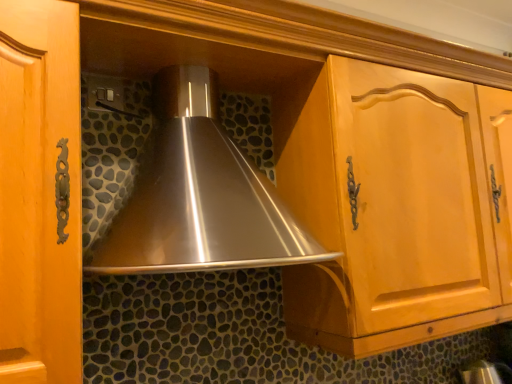
What do you see at coordinates (199, 195) in the screenshot? I see `stainless steel vent at center` at bounding box center [199, 195].

Where is `stainless steel vent at center`? The height and width of the screenshot is (384, 512). stainless steel vent at center is located at coordinates (199, 195).

In order to face stainless steel vent at center, should I rotate leftwards or rightwards?

Rotate left and turn 4.994 degrees.

What are the coordinates of `stainless steel vent at center` in the screenshot? It's located at (199, 195).